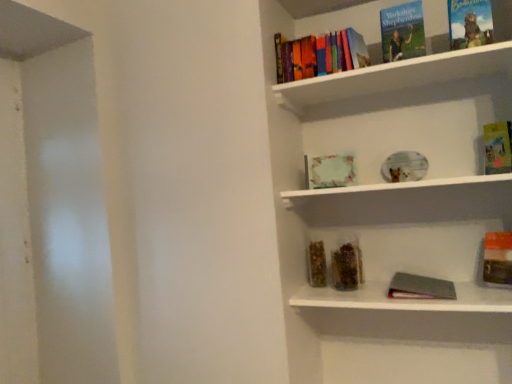
The width and height of the screenshot is (512, 384). I want to click on hardcover book at upper center, the second book from the top, so coord(402,32).

Measure the distance between hardcover book at upper center, marked as the seventh book in a bottom-to-top arrangement, and camera.

hardcover book at upper center, marked as the seventh book in a bottom-to-top arrangement, and camera are 1.64 meters apart from each other.

What do you see at coordinates (330, 171) in the screenshot?
I see `pastel paper frame at center, which appears as the fifth book when viewed from the top` at bounding box center [330, 171].

Describe the element at coordinates (498, 147) in the screenshot. This screenshot has height=384, width=512. I see `hardcover book at upper right, which is counted as the 5th book, starting from the bottom` at that location.

The width and height of the screenshot is (512, 384). What are the coordinates of `hardcover books at upper center, which is the sixth book in bottom-to-top order` in the screenshot? It's located at (319, 55).

What do you see at coordinates (420, 287) in the screenshot? I see `gray matte book at lower right, placed as the 1th book when sorted from bottom to top` at bounding box center [420, 287].

Describe the element at coordinates (317, 264) in the screenshot. I see `translucent plastic container at center, arranged as the second book when ordered from the bottom` at that location.

The height and width of the screenshot is (384, 512). Find the location of `orange matte book at lower right, positioned as the third book in bottom-to-top order`. orange matte book at lower right, positioned as the third book in bottom-to-top order is located at coordinates (497, 258).

Is hardcover book at upper right, which is counted as the 5th book, starting from the bottom, further to the viewer compared to metallic silver book at lower center, the second window sill when ordered from top to bottom?

Yes, hardcover book at upper right, which is counted as the 5th book, starting from the bottom, is behind metallic silver book at lower center, the second window sill when ordered from top to bottom.

From the image's perspective, is hardcover book at upper right, which is counted as the 5th book, starting from the bottom, under metallic silver book at lower center, arranged as the 1th window sill when ordered from the bottom?

No, from the image's perspective, hardcover book at upper right, which is counted as the 5th book, starting from the bottom, is not below metallic silver book at lower center, arranged as the 1th window sill when ordered from the bottom.

Is hardcover book at upper right, which is counted as the 5th book, starting from the bottom, inside the boundaries of metallic silver book at lower center, arranged as the 1th window sill when ordered from the bottom, or outside?

The correct answer is: outside.

Is hardcover book at upper right, which is counted as the 5th book, starting from the bottom, shorter than metallic silver book at lower center, arranged as the 1th window sill when ordered from the bottom?

No.

Is hardcover books at upper center oriented away from white matte plate at center, which is counted as the 1th window sill, starting from the top?

No, hardcover books at upper center's orientation is not away from white matte plate at center, which is counted as the 1th window sill, starting from the top.

Does hardcover books at upper center appear on the left side of white matte plate at center, the 2th window sill ordered from the bottom?

Yes, hardcover books at upper center is to the left of white matte plate at center, the 2th window sill ordered from the bottom.

In the scene shown: Is hardcover books at upper center next to white matte plate at center, which is counted as the 1th window sill, starting from the top, and touching it?

hardcover books at upper center and white matte plate at center, which is counted as the 1th window sill, starting from the top, are not in contact.

Is point (377, 65) closer or farther from the camera than point (476, 180)?

Point (377, 65) appears to be closer to the viewer than point (476, 180).

Is hardcover book at upper center, the second book from the top, far from hardcover book at upper right, the first book viewed from the top?

No, hardcover book at upper center, the second book from the top, is in close proximity to hardcover book at upper right, the first book viewed from the top.

Could you tell me if hardcover book at upper center, marked as the seventh book in a bottom-to-top arrangement, is facing hardcover book at upper right, marked as the 8th book in a bottom-to-top arrangement?

No, hardcover book at upper center, marked as the seventh book in a bottom-to-top arrangement, does not turn towards hardcover book at upper right, marked as the 8th book in a bottom-to-top arrangement.

Does hardcover book at upper center, the second book from the top, have a greater height compared to hardcover book at upper right, marked as the 8th book in a bottom-to-top arrangement?

Correct, hardcover book at upper center, the second book from the top, is much taller as hardcover book at upper right, marked as the 8th book in a bottom-to-top arrangement.

Based on their sizes in the image, would you say hardcover book at upper right, the 4th book when ordered from top to bottom, is bigger or smaller than hardcover book at upper right, marked as the 8th book in a bottom-to-top arrangement?

In the image, hardcover book at upper right, the 4th book when ordered from top to bottom, appears to be smaller than hardcover book at upper right, marked as the 8th book in a bottom-to-top arrangement.

Is hardcover book at upper right, which is counted as the 5th book, starting from the bottom, facing towards hardcover book at upper right, the first book viewed from the top?

No, hardcover book at upper right, which is counted as the 5th book, starting from the bottom, is not facing towards hardcover book at upper right, the first book viewed from the top.

Which object is positioned more to the right, hardcover book at upper right, the 4th book when ordered from top to bottom, or hardcover book at upper right, marked as the 8th book in a bottom-to-top arrangement?

hardcover book at upper right, the 4th book when ordered from top to bottom.

The width and height of the screenshot is (512, 384). What are the coordinates of `the 5th book below the hardcover book at upper right, marked as the 8th book in a bottom-to-top arrangement (from a real-world perspective)` in the screenshot? It's located at (420, 287).

From the image's perspective, which object appears higher, gray matte book at lower right, placed as the 1th book when sorted from bottom to top, or hardcover book at upper right, marked as the 8th book in a bottom-to-top arrangement?

hardcover book at upper right, marked as the 8th book in a bottom-to-top arrangement, appears higher in the image.

Between gray matte book at lower right, which is counted as the 8th book, starting from the top, and hardcover book at upper right, marked as the 8th book in a bottom-to-top arrangement, which one has less height?

gray matte book at lower right, which is counted as the 8th book, starting from the top, is shorter.

Between gray matte book at lower right, placed as the 1th book when sorted from bottom to top, and hardcover book at upper right, the first book viewed from the top, which one has larger width?

With larger width is gray matte book at lower right, placed as the 1th book when sorted from bottom to top.

Is point (280, 70) in front of point (417, 12)?

No, it is behind (417, 12).

Who is more distant, hardcover books at upper center, which is the sixth book in bottom-to-top order, or hardcover book at upper center, the second book from the top?

hardcover books at upper center, which is the sixth book in bottom-to-top order, is further from the camera.

Considering the sizes of objects hardcover books at upper center, which is the sixth book in bottom-to-top order, and hardcover book at upper center, the second book from the top, in the image provided, who is bigger, hardcover books at upper center, which is the sixth book in bottom-to-top order, or hardcover book at upper center, the second book from the top,?

hardcover books at upper center, which is the sixth book in bottom-to-top order.

Is hardcover books at upper center, which is the sixth book in bottom-to-top order, turned away from hardcover book at upper center, marked as the seventh book in a bottom-to-top arrangement?

No.

Considering the sizes of translucent plastic container at center, arranged as the second book when ordered from the bottom, and hardcover book at upper right, the 4th book when ordered from top to bottom, in the image, is translucent plastic container at center, arranged as the second book when ordered from the bottom, wider or thinner than hardcover book at upper right, the 4th book when ordered from top to bottom,?

In the image, translucent plastic container at center, arranged as the second book when ordered from the bottom, appears to be wider than hardcover book at upper right, the 4th book when ordered from top to bottom.

Which object is positioned more to the left, translucent plastic container at center, arranged as the second book when ordered from the bottom, or hardcover book at upper right, the 4th book when ordered from top to bottom?

Positioned to the left is translucent plastic container at center, arranged as the second book when ordered from the bottom.

Is translucent plastic container at center, positioned as the 7th book in top-to-bottom order, with hardcover book at upper right, which is counted as the 5th book, starting from the bottom?

No, translucent plastic container at center, positioned as the 7th book in top-to-bottom order, is not making contact with hardcover book at upper right, which is counted as the 5th book, starting from the bottom.

Starting from the hardcover book at upper right, which is counted as the 5th book, starting from the bottom, which window sill is the 1st one in front? Please provide its 2D coordinates.

[(406, 299)]

Locate an element on the screen. This screenshot has width=512, height=384. cabinet above the white matte plate at center, the 2th window sill ordered from the bottom (from a real-world perspective) is located at coordinates (395, 76).

From the image, which object appears to be farther from pastel paper frame at center, marked as the 4th book in a bottom-to-top arrangement, hardcover books at upper center, which is the sixth book in bottom-to-top order, or hardcover book at upper right, the first book viewed from the top?

hardcover book at upper right, the first book viewed from the top, is further to pastel paper frame at center, marked as the 4th book in a bottom-to-top arrangement.

Looking at the image, which one is located closer to hardcover books at upper center, hardcover book at upper right, the 4th book when ordered from top to bottom, or gray matte book at lower right, placed as the 1th book when sorted from bottom to top?

hardcover book at upper right, the 4th book when ordered from top to bottom, is positioned closer to the anchor hardcover books at upper center.

Considering their positions, is hardcover books at upper center positioned further to metallic silver book at lower center, arranged as the 1th window sill when ordered from the bottom, than white matte plate at center, which is counted as the 1th window sill, starting from the top?

Based on the image, hardcover books at upper center appears to be further to metallic silver book at lower center, arranged as the 1th window sill when ordered from the bottom.

In the scene shown: From the image, which object appears to be farther from pastel paper frame at center, which appears as the fifth book when viewed from the top, translucent plastic container at center, arranged as the second book when ordered from the bottom, or hardcover books at upper center, which is the sixth book in bottom-to-top order?

hardcover books at upper center, which is the sixth book in bottom-to-top order, is further to pastel paper frame at center, which appears as the fifth book when viewed from the top.

From the picture: Which object lies further to the anchor point pastel paper frame at center, marked as the 4th book in a bottom-to-top arrangement, metallic silver book at lower center, the second window sill when ordered from top to bottom, or orange matte book at lower right, which is the 6th book from top to bottom?

orange matte book at lower right, which is the 6th book from top to bottom, is further to pastel paper frame at center, marked as the 4th book in a bottom-to-top arrangement.

From the image, which object appears to be farther from hardcover book at upper right, the 4th book when ordered from top to bottom, gray matte book at lower right, placed as the 1th book when sorted from bottom to top, or hardcover book at upper center, marked as the seventh book in a bottom-to-top arrangement?

Based on the image, gray matte book at lower right, placed as the 1th book when sorted from bottom to top, appears to be further to hardcover book at upper right, the 4th book when ordered from top to bottom.

Based on their spatial positions, is orange matte book at lower right, positioned as the third book in bottom-to-top order, or hardcover book at upper right, the 4th book when ordered from top to bottom, closer to white matte plate at center, which is counted as the 1th window sill, starting from the top?

hardcover book at upper right, the 4th book when ordered from top to bottom, lies closer to white matte plate at center, which is counted as the 1th window sill, starting from the top, than the other object.

From the image, which object appears to be nearer to metallic silver book at lower center, the second window sill when ordered from top to bottom, translucent plastic container at center, positioned as the 7th book in top-to-bottom order, or hardcover books at upper center?

translucent plastic container at center, positioned as the 7th book in top-to-bottom order, is closer to metallic silver book at lower center, the second window sill when ordered from top to bottom.

In order to click on window sill that lies between hardcover books at upper center, marked as the 3th book in a top-to-bottom arrangement, and gray matte book at lower right, placed as the 1th book when sorted from bottom to top, from top to bottom in this screenshot , I will do `click(397, 186)`.

The height and width of the screenshot is (384, 512). In order to click on cabinet between hardcover book at upper center, marked as the seventh book in a bottom-to-top arrangement, and translucent plastic container at center, arranged as the second book when ordered from the bottom, from top to bottom in this screenshot , I will do `click(395, 76)`.

Identify the location of window sill between hardcover book at upper right, which is counted as the 5th book, starting from the bottom, and orange matte book at lower right, which is the 6th book from top to bottom, in the vertical direction. (397, 186).

What are the coordinates of `window sill between hardcover books at upper center and gray matte book at lower right, placed as the 1th book when sorted from bottom to top, from top to bottom` in the screenshot? It's located at (397, 186).